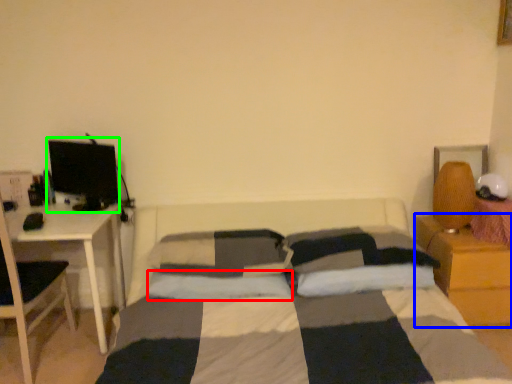
Question: Based on their relative distances, which object is nearer to pillow (highlighted by a red box)? Choose from nightstand (highlighted by a blue box) and computer monitor (highlighted by a green box).

Choices:
 (A) nightstand
 (B) computer monitor

Answer: (B)